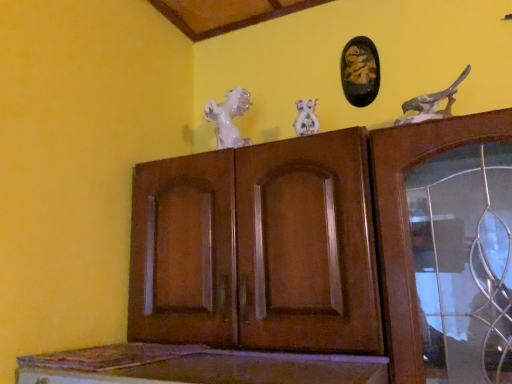
Question: Should I look upward or downward to see black glossy picture frame at upper center?

Choices:
 (A) down
 (B) up

Answer: (B)

Question: Is brown wood cupboard at center inside black glossy picture frame at upper center?

Choices:
 (A) no
 (B) yes

Answer: (A)

Question: Does black glossy picture frame at upper center have a lesser width compared to brown wood cupboard at center?

Choices:
 (A) no
 (B) yes

Answer: (B)

Question: Considering the relative sizes of black glossy picture frame at upper center and brown wood cupboard at center in the image provided, is black glossy picture frame at upper center bigger than brown wood cupboard at center?

Choices:
 (A) yes
 (B) no

Answer: (B)

Question: Is brown wood cupboard at center at the back of black glossy picture frame at upper center?

Choices:
 (A) no
 (B) yes

Answer: (A)

Question: Are black glossy picture frame at upper center and brown wood cupboard at center far apart?

Choices:
 (A) no
 (B) yes

Answer: (A)

Question: Is the position of black glossy picture frame at upper center more distant than that of brown wood cupboard at center?

Choices:
 (A) yes
 (B) no

Answer: (A)

Question: Are speckled stone bird at upper right, which appears as the 2th animal when viewed from the back, and white porcelain dog at center making contact?

Choices:
 (A) no
 (B) yes

Answer: (A)

Question: Considering the relative sizes of speckled stone bird at upper right, arranged as the first animal when viewed from the front, and white porcelain dog at center in the image provided, is speckled stone bird at upper right, arranged as the first animal when viewed from the front, thinner than white porcelain dog at center?

Choices:
 (A) no
 (B) yes

Answer: (A)

Question: Is speckled stone bird at upper right, arranged as the first animal when viewed from the front, closer to camera compared to white porcelain dog at center?

Choices:
 (A) no
 (B) yes

Answer: (B)

Question: Can white porcelain dog at center be found inside speckled stone bird at upper right, arranged as the first animal when viewed from the front?

Choices:
 (A) yes
 (B) no

Answer: (B)

Question: Is speckled stone bird at upper right, arranged as the first animal when viewed from the front, completely or partially outside of white porcelain dog at center?

Choices:
 (A) yes
 (B) no

Answer: (A)

Question: Considering the relative positions of speckled stone bird at upper right, which appears as the second animal when viewed from the left, and white porcelain dog at center in the image provided, is speckled stone bird at upper right, which appears as the second animal when viewed from the left, to the left of white porcelain dog at center from the viewer's perspective?

Choices:
 (A) yes
 (B) no

Answer: (B)

Question: Is white porcelain dog at center thinner than speckled stone bird at upper right, which appears as the 2th animal when viewed from the back?

Choices:
 (A) no
 (B) yes

Answer: (B)